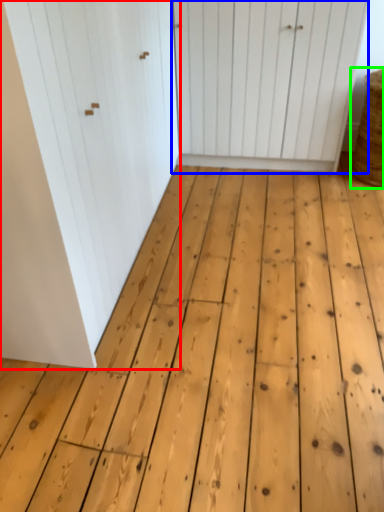
Question: Estimate the real-world distances between objects in this image. Which object is farther from door (highlighted by a red box), door (highlighted by a blue box) or basket (highlighted by a green box)?

Choices:
 (A) door
 (B) basket

Answer: (B)